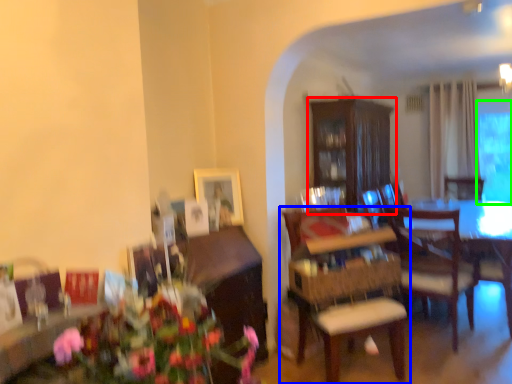
Question: Which object is positioned closest to cabinetry (highlighted by a red box)? Select from chair (highlighted by a blue box) and window screen (highlighted by a green box).

Choices:
 (A) chair
 (B) window screen

Answer: (A)